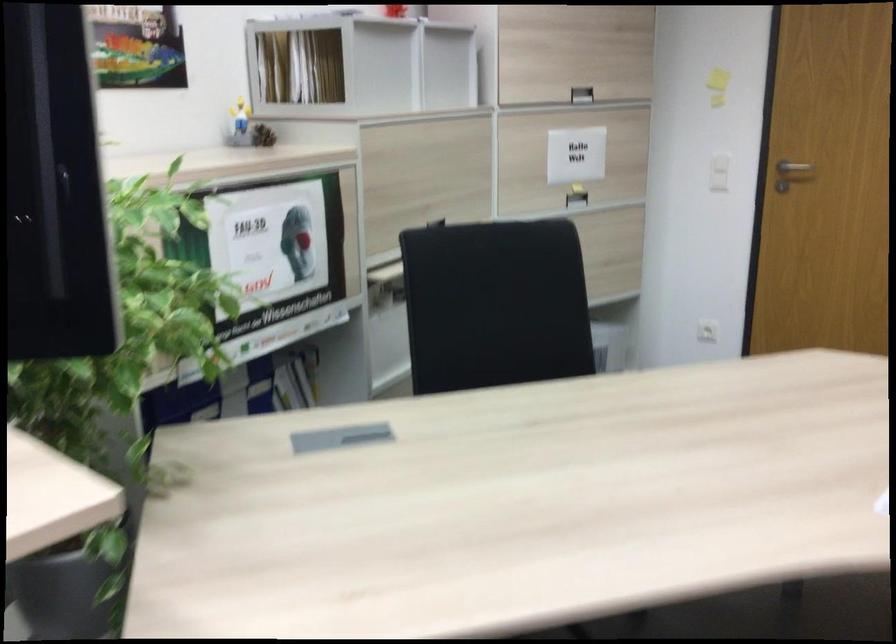
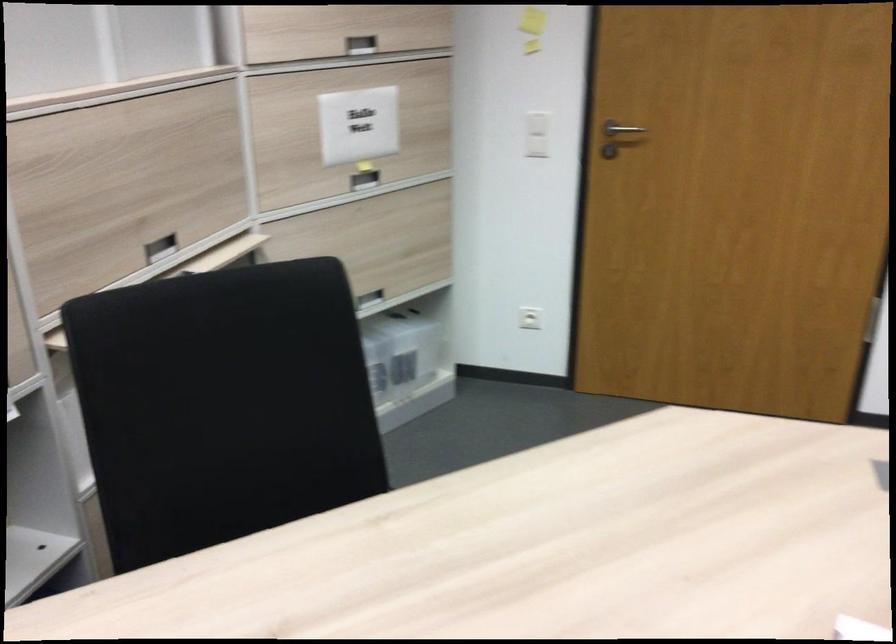
Find the pixel in the second image that matches (x=578, y=196) in the first image.

(364, 180)